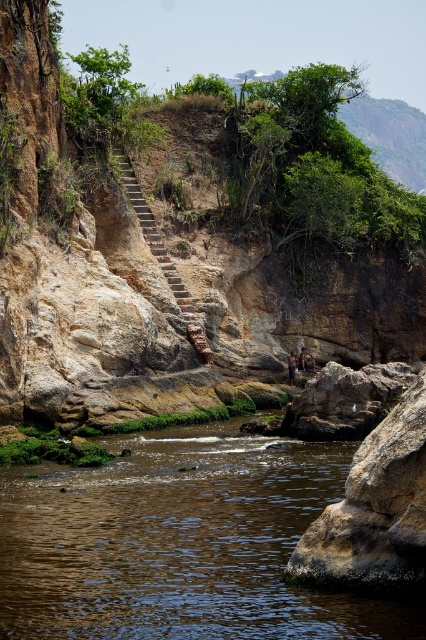
You are a hiker who has just reached the cliffside. You notice a brown leather jacket at center and a tan skin person at center. Which object is closer to you?

The brown leather jacket at center is 16.15 feet away from the tan skin person at center, so the tan skin person at center is closer to you.

You are a hiker who has just reached the top of the cliff. You see a brown leather jacket at center and a tan skin person at center below you. Which object is closer to the cliff edge?

The brown leather jacket at center is much taller than the tan skin person at center, so it is closer to the cliff edge.